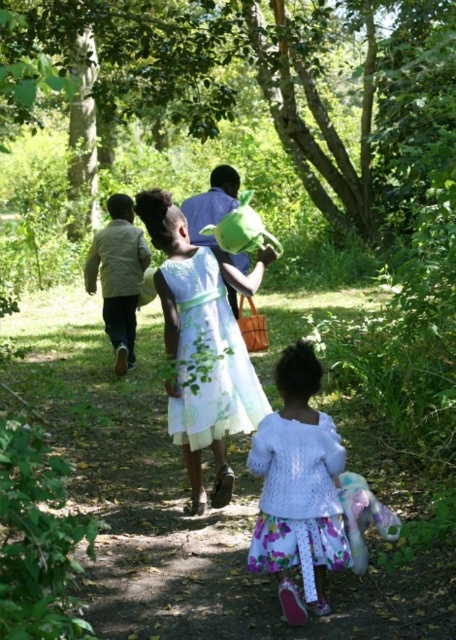
You are a photographer standing in the forest and want to take a photo of the green leafy trees at center and the light green fabric dress at center. If your camera has a depth of field that can focus on objects within 20 feet of each other, will both subjects be in focus?

The distance between the green leafy trees at center and the light green fabric dress at center is 22.05 feet. Since this exceeds the camera sensor depth of field range of 20 feet, only one of the subjects will be in focus at a time.

You are a photographer trying to capture a photo of the light green fabric dress at center without the green leafy trees at center blocking the view. Based on their positions, is it possible to frame the shot so that the dress is visible without the trees obstructing it?

The green leafy trees at center are above the light green fabric dress at center, so if you lower your camera angle or move to a position where the trees are out of the frame above, you can capture the dress without obstruction.